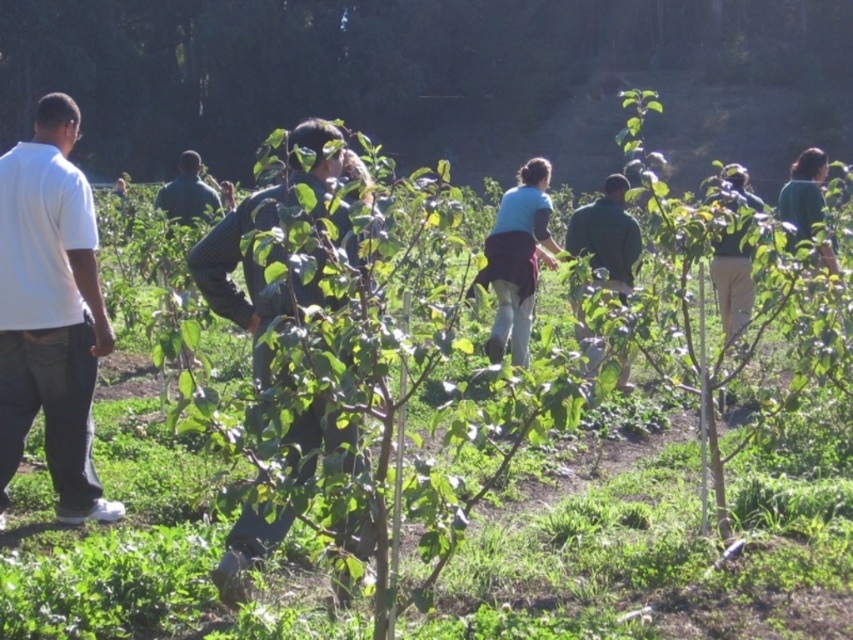
You are standing at the origin point of the coordinate system in the garden scene. You want to move towards the white cotton shirt at left. What direction should you move in to reach it?

The white cotton shirt at left is located at coordinate point 0.487 on the x axis and 0.060 on the y axis. Since you are at the origin, you should move towards the positive x direction and slightly towards the positive y direction to reach it.

You are standing at the point labeled as point (50, 310) in the image. What object is located exactly at that coordinate?

The point (50, 310) corresponds to the white cotton shirt at left.